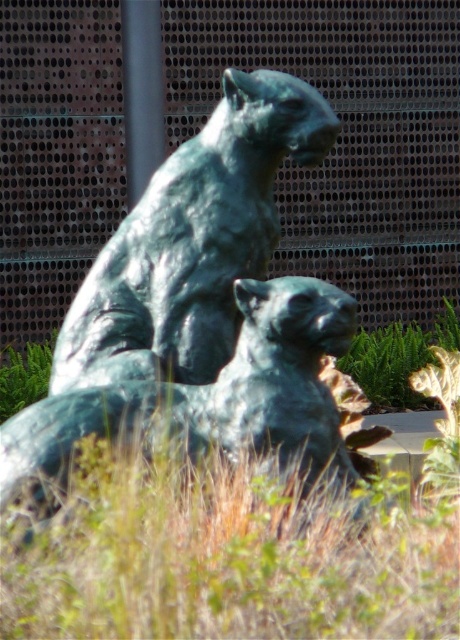
You are an art installer who needs to ensure the green patina statue at center and the metallic pole at upper center are visible in a photo. Based on their heights, which object will appear larger in the photo?

The green patina statue at center is taller than the metallic pole at upper center, so it will appear larger in the photo.

You are standing in front of the bronze panther sculpture and notice a metallic pole at upper center and green grass at lower center. Which object is positioned to the right of the other?

The green grass at lower center is positioned to the right of the metallic pole at upper center.

You are a landscape architect designing a garden around the green patina statue at center and the green grass at lower center. Considering their sizes, which object should you prioritize in terms of space allocation?

The green patina statue at center has a larger size compared to the green grass at lower center, so you should prioritize allocating more space to the green patina statue at center to accommodate its size.